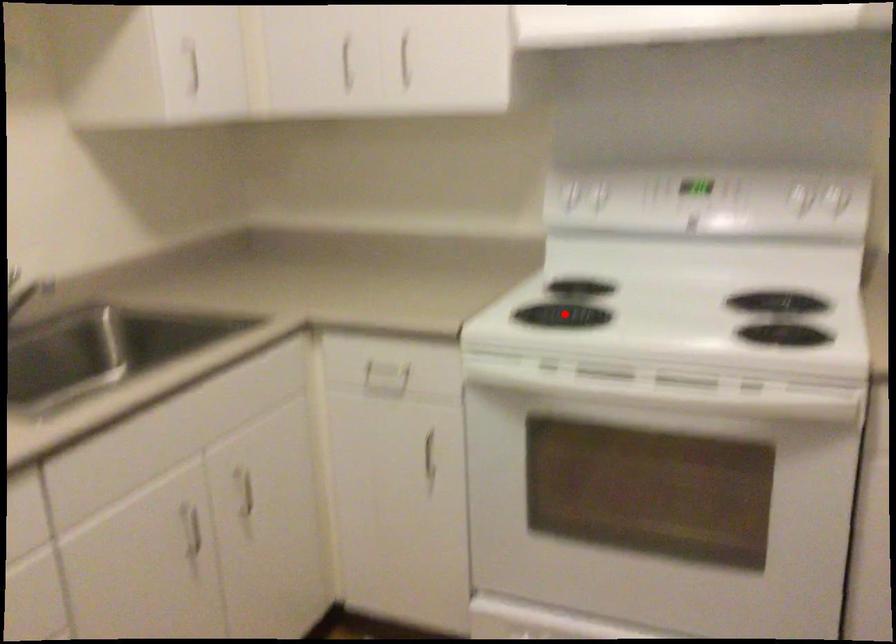
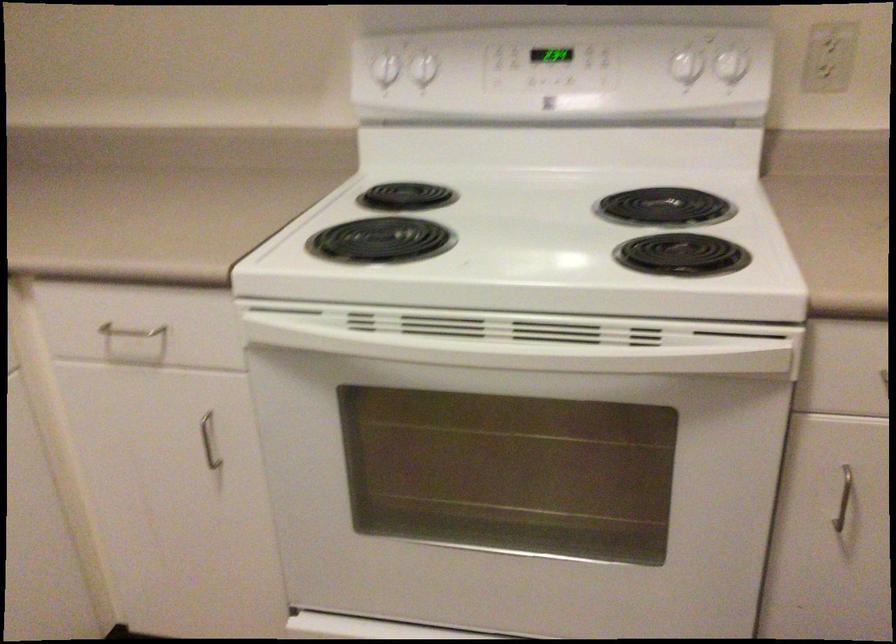
Question: I am providing you with two images of the same scene from different viewpoints. A red point is marked on the first image. Can you still see the location of the red point in image 2?

Choices:
 (A) Yes
 (B) No

Answer: (A)